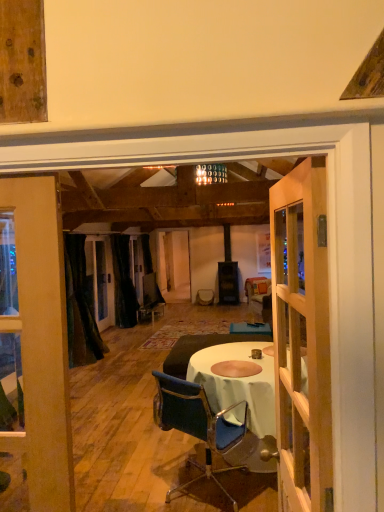
Question: Is clear glass window at left bigger than black velvet curtain at left, which is the 2th curtain from back to front?

Choices:
 (A) yes
 (B) no

Answer: (A)

Question: Is clear glass window at left oriented towards black velvet curtain at left, which is the 2th curtain from back to front?

Choices:
 (A) yes
 (B) no

Answer: (B)

Question: Does clear glass window at left have a lesser height compared to black velvet curtain at left, which is the 2th curtain from back to front?

Choices:
 (A) no
 (B) yes

Answer: (B)

Question: From the image's perspective, does clear glass window at left appear lower than black velvet curtain at left, placed as the 1th curtain when sorted from front to back?

Choices:
 (A) no
 (B) yes

Answer: (B)

Question: Is clear glass window at left looking in the opposite direction of black velvet curtain at left, placed as the 1th curtain when sorted from front to back?

Choices:
 (A) no
 (B) yes

Answer: (A)

Question: Is clear glass window at left positioned before black velvet curtain at left, placed as the 1th curtain when sorted from front to back?

Choices:
 (A) no
 (B) yes

Answer: (B)

Question: Would you say wooden door at center contains black velvet curtain at left, placed as the 1th curtain when sorted from front to back?

Choices:
 (A) no
 (B) yes

Answer: (A)

Question: Does wooden door at center have a greater width compared to black velvet curtain at left, which is the 2th curtain from back to front?

Choices:
 (A) no
 (B) yes

Answer: (A)

Question: Does wooden door at center appear on the left side of black velvet curtain at left, which is the 2th curtain from back to front?

Choices:
 (A) yes
 (B) no

Answer: (B)

Question: Can you confirm if wooden door at center is taller than black velvet curtain at left, placed as the 1th curtain when sorted from front to back?

Choices:
 (A) no
 (B) yes

Answer: (A)

Question: From a real-world perspective, is wooden door at center positioned under black velvet curtain at left, placed as the 1th curtain when sorted from front to back, based on gravity?

Choices:
 (A) yes
 (B) no

Answer: (B)

Question: Is wooden door at center positioned beyond the bounds of black velvet curtain at left, which is the 2th curtain from back to front?

Choices:
 (A) no
 (B) yes

Answer: (B)

Question: From the image's perspective, is black velvet curtain at center, the 2th curtain from the front, beneath clear glass window at left?

Choices:
 (A) no
 (B) yes

Answer: (A)